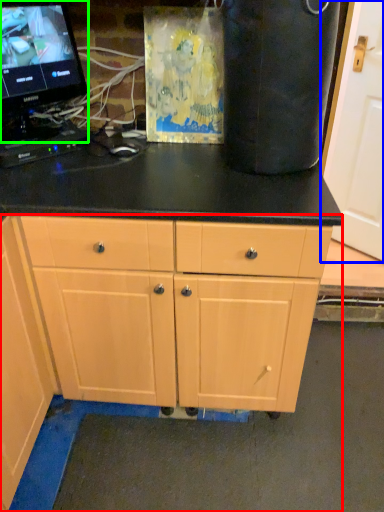
Question: Which object is the closest to the cabinet (highlighted by a red box)? Choose among these: door (highlighted by a blue box) or computer monitor (highlighted by a green box).

Choices:
 (A) door
 (B) computer monitor

Answer: (B)